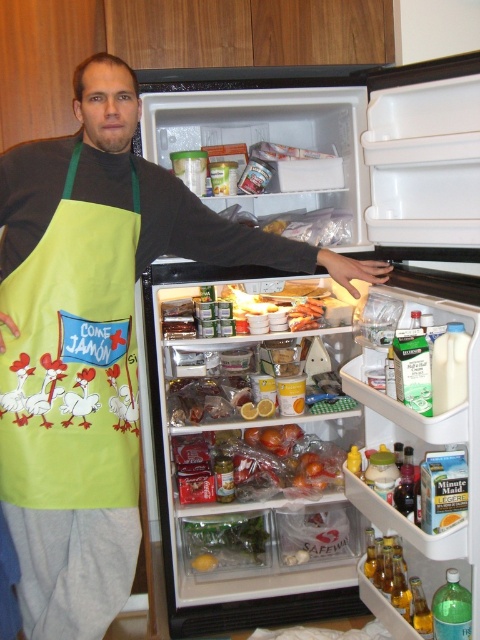
Question: Is matte plastic refrigerator at center closer to the viewer compared to green fabric apron at left?

Choices:
 (A) yes
 (B) no

Answer: (A)

Question: Which of the following is the closest to the observer?

Choices:
 (A) matte plastic refrigerator at center
 (B) green fabric apron at left

Answer: (A)

Question: Does matte plastic refrigerator at center appear under green fabric apron at left?

Choices:
 (A) no
 (B) yes

Answer: (A)

Question: Which point is closer to the camera taking this photo?

Choices:
 (A) (11, 376)
 (B) (228, 605)

Answer: (A)

Question: Does matte plastic refrigerator at center appear on the right side of green fabric apron at left?

Choices:
 (A) no
 (B) yes

Answer: (B)

Question: Among these objects, which one is nearest to the camera?

Choices:
 (A) matte plastic refrigerator at center
 (B) green fabric apron at left

Answer: (A)